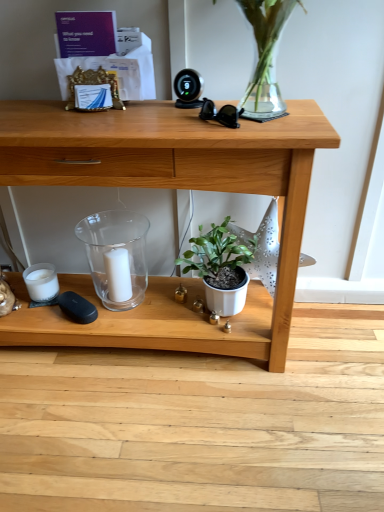
Question: Is transparent glass candle holder at center at the right side of wooden desk at center?

Choices:
 (A) no
 (B) yes

Answer: (A)

Question: Does transparent glass candle holder at center have a lesser height compared to wooden desk at center?

Choices:
 (A) yes
 (B) no

Answer: (A)

Question: From the image's perspective, is transparent glass candle holder at center beneath wooden desk at center?

Choices:
 (A) no
 (B) yes

Answer: (B)

Question: Considering the relative positions of transparent glass candle holder at center and wooden desk at center in the image provided, is transparent glass candle holder at center to the left of wooden desk at center from the viewer's perspective?

Choices:
 (A) no
 (B) yes

Answer: (B)

Question: Considering the relative positions of transparent glass candle holder at center and wooden desk at center in the image provided, is transparent glass candle holder at center behind wooden desk at center?

Choices:
 (A) no
 (B) yes

Answer: (B)

Question: Considering their positions, is transparent glass candle holder at center located in front of or behind white matte pot at center?

Choices:
 (A) behind
 (B) front

Answer: (A)

Question: Is transparent glass candle holder at center bigger or smaller than white matte pot at center?

Choices:
 (A) small
 (B) big

Answer: (A)

Question: In terms of height, does transparent glass candle holder at center look taller or shorter compared to white matte pot at center?

Choices:
 (A) tall
 (B) short

Answer: (A)

Question: Is transparent glass candle holder at center wider or thinner than white matte pot at center?

Choices:
 (A) thin
 (B) wide

Answer: (A)

Question: From the image's perspective, is wooden desk at center located above or below white matte candle at center?

Choices:
 (A) above
 (B) below

Answer: (A)

Question: In terms of height, does wooden desk at center look taller or shorter compared to white matte candle at center?

Choices:
 (A) tall
 (B) short

Answer: (A)

Question: Does point (112, 343) appear closer or farther from the camera than point (117, 247)?

Choices:
 (A) farther
 (B) closer

Answer: (B)

Question: Considering the positions of wooden desk at center and white matte candle at center in the image, is wooden desk at center bigger or smaller than white matte candle at center?

Choices:
 (A) small
 (B) big

Answer: (B)

Question: Considering their positions, is transparent glass candle holder at center located in front of or behind white matte candle at center?

Choices:
 (A) front
 (B) behind

Answer: (A)

Question: From a real-world perspective, is transparent glass candle holder at center above or below white matte candle at center?

Choices:
 (A) below
 (B) above

Answer: (B)